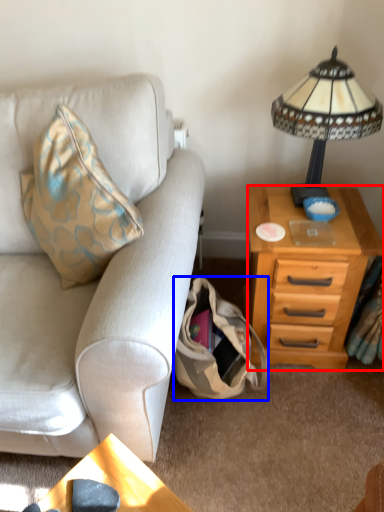
Question: Which object appears farthest to the camera in this image, nightstand (highlighted by a red box) or handbag (highlighted by a blue box)?

Choices:
 (A) nightstand
 (B) handbag

Answer: (A)